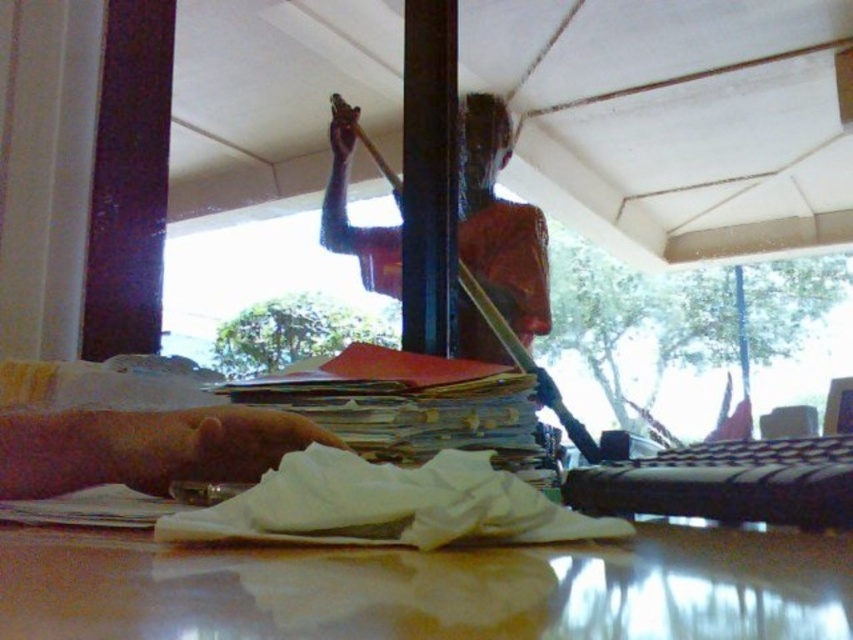
Question: Does glossy wooden table at center have a smaller size compared to pink skin at lower left?

Choices:
 (A) no
 (B) yes

Answer: (A)

Question: Which object is farther from the camera taking this photo?

Choices:
 (A) smooth brown skin at upper center
 (B) glossy wooden table at center
 (C) pink skin at lower left

Answer: (A)

Question: Which object is positioned closest to the glossy wooden table at center?

Choices:
 (A) smooth brown skin at upper center
 (B) pink skin at lower left

Answer: (B)

Question: Does glossy wooden table at center appear on the right side of smooth brown skin at upper center?

Choices:
 (A) no
 (B) yes

Answer: (A)

Question: Where is glossy wooden table at center located in relation to smooth brown skin at upper center in the image?

Choices:
 (A) below
 (B) above

Answer: (A)

Question: Which point appears closest to the camera in this image?

Choices:
 (A) (485, 324)
 (B) (86, 536)
 (C) (206, 467)

Answer: (B)